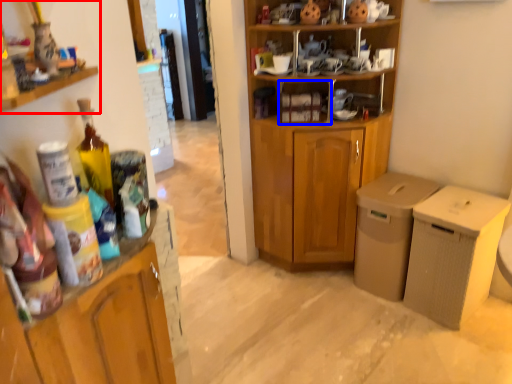
Question: Which object appears closest to the camera in this image, cabinetry (highlighted by a red box) or cabinet (highlighted by a blue box)?

Choices:
 (A) cabinetry
 (B) cabinet

Answer: (A)